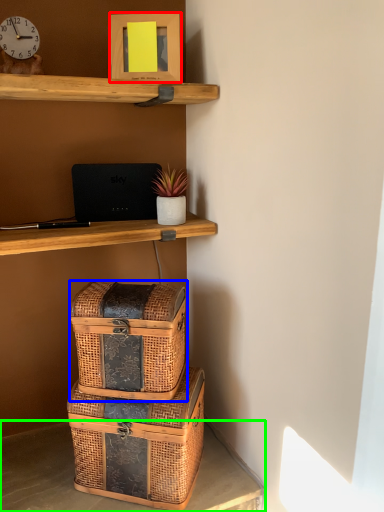
Question: Estimate the real-world distances between objects in this image. Which object is closer to picture frame (highlighted by a red box), box (highlighted by a blue box) or desk (highlighted by a green box)?

Choices:
 (A) box
 (B) desk

Answer: (A)